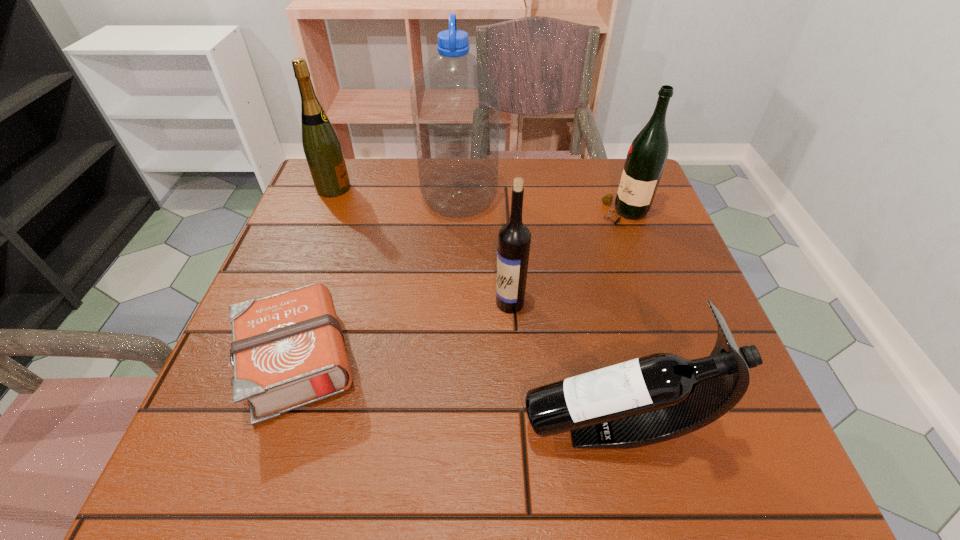
Find the location of a particular element. Image resolution: width=960 pixels, height=540 pixels. blank space at the far right corner is located at coordinates (616, 177).

Identify the location of vacant area that lies between the nearest wine bottle and the third nearest wine bottle. (619, 320).

Locate an element on the screen. This screenshot has width=960, height=540. free point between the farthest wine bottle and the second nearest wine bottle is located at coordinates (421, 246).

Locate an element on the screen. Image resolution: width=960 pixels, height=540 pixels. vacant area between the third nearest wine bottle and the tallest object is located at coordinates (541, 206).

The image size is (960, 540). In order to click on free space between the second nearest wine bottle and the water jug in this screenshot , I will do `click(485, 251)`.

At what (x,y) coordinates should I click in order to perform the action: click on vacant space that is in between the third farthest wine bottle and the nearest wine bottle. Please return your answer as a coordinate pair (x, y). Looking at the image, I should click on (562, 366).

Find the location of `vacant space that is in between the second nearest wine bottle and the nearest wine bottle`. vacant space that is in between the second nearest wine bottle and the nearest wine bottle is located at coordinates (562, 366).

You are a GUI agent. You are given a task and a screenshot of the screen. Output one action in this format:
    pyautogui.click(x=<x>, y=<y>)
    Task: Click on the vacant space that's between the nearest wine bottle and the third farthest wine bottle
    The image size is (960, 540).
    Given the screenshot: What is the action you would take?
    pyautogui.click(x=562, y=366)

Locate an element on the screen. free space between the third farthest wine bottle and the second farthest wine bottle is located at coordinates (567, 258).

Locate an element on the screen. empty location between the Bible and the tallest object is located at coordinates (x=379, y=280).